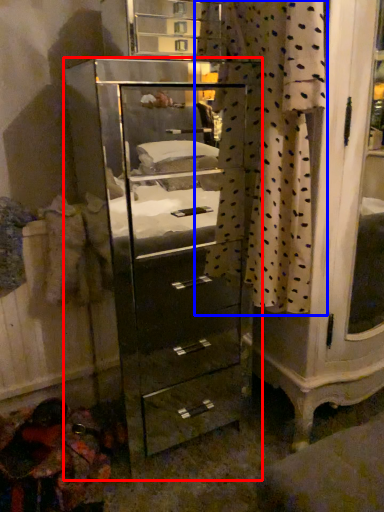
Question: Which object is closer to the camera taking this photo, chest of drawers (highlighted by a red box) or curtain (highlighted by a blue box)?

Choices:
 (A) chest of drawers
 (B) curtain

Answer: (B)